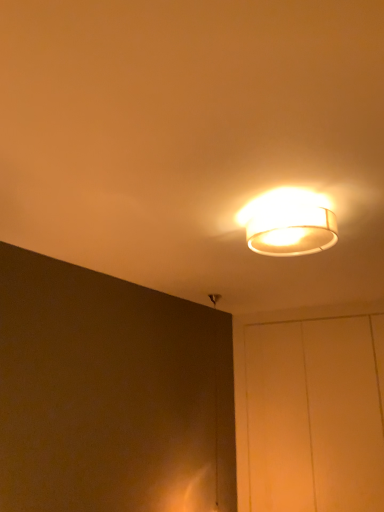
What do you see at coordinates (289, 223) in the screenshot?
I see `white glossy ring light at upper center` at bounding box center [289, 223].

I want to click on white glossy ring light at upper center, so click(289, 223).

In order to click on white glossy ring light at upper center in this screenshot , I will do [289, 223].